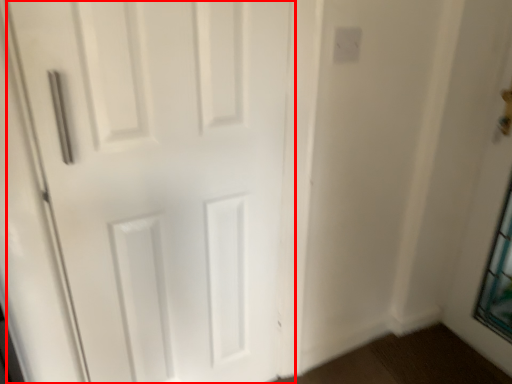
Question: From the image's perspective, what is the correct spatial positioning of door (annotated by the red box) in reference to electric outlet?

Choices:
 (A) below
 (B) above

Answer: (A)